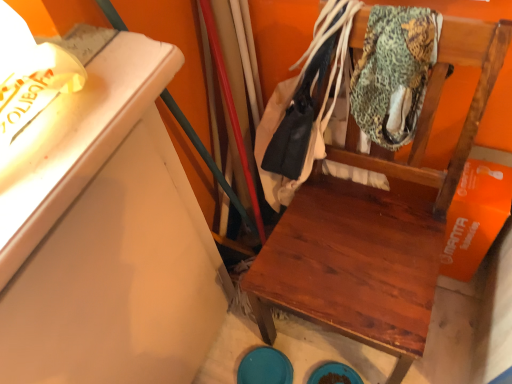
Question: From the image's perspective, does wooden chair at center appear higher than leather jacket at center?

Choices:
 (A) yes
 (B) no

Answer: (B)

Question: Considering the relative sizes of wooden chair at center and leather jacket at center in the image provided, is wooden chair at center bigger than leather jacket at center?

Choices:
 (A) yes
 (B) no

Answer: (A)

Question: Would you say wooden chair at center contains leather jacket at center?

Choices:
 (A) no
 (B) yes

Answer: (B)

Question: Is wooden chair at center in front of leather jacket at center?

Choices:
 (A) yes
 (B) no

Answer: (A)

Question: From the image's perspective, is wooden chair at center located beneath leather jacket at center?

Choices:
 (A) yes
 (B) no

Answer: (A)

Question: From a real-world perspective, is leather jacket at center above or below wooden chair at center?

Choices:
 (A) below
 (B) above

Answer: (B)

Question: Is leather jacket at center to the left or to the right of wooden chair at center in the image?

Choices:
 (A) left
 (B) right

Answer: (A)

Question: Considering the positions of leather jacket at center and wooden chair at center in the image, is leather jacket at center bigger or smaller than wooden chair at center?

Choices:
 (A) small
 (B) big

Answer: (A)

Question: Does point (276, 92) appear closer or farther from the camera than point (387, 314)?

Choices:
 (A) closer
 (B) farther

Answer: (B)

Question: In terms of width, does textured green fabric at upper right look wider or thinner when compared to wooden chair at center?

Choices:
 (A) wide
 (B) thin

Answer: (B)

Question: From the image's perspective, is textured green fabric at upper right above or below wooden chair at center?

Choices:
 (A) above
 (B) below

Answer: (A)

Question: Is textured green fabric at upper right inside the boundaries of wooden chair at center, or outside?

Choices:
 (A) outside
 (B) inside

Answer: (B)

Question: Considering the positions of point (376, 13) and point (290, 306), is point (376, 13) closer or farther from the camera than point (290, 306)?

Choices:
 (A) farther
 (B) closer

Answer: (B)

Question: Is point (286, 258) closer or farther from the camera than point (394, 29)?

Choices:
 (A) farther
 (B) closer

Answer: (A)

Question: Choose the correct answer: Is wooden chair at center inside textured green fabric at upper right or outside it?

Choices:
 (A) inside
 (B) outside

Answer: (B)